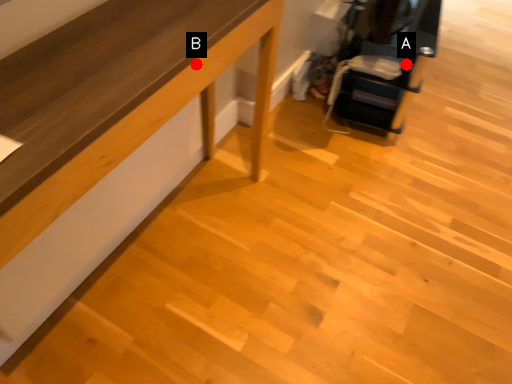
Question: Two points are circled on the image, labeled by A and B beside each circle. Which of the following is the closest to the observer?

Choices:
 (A) A is closer
 (B) B is closer

Answer: (B)